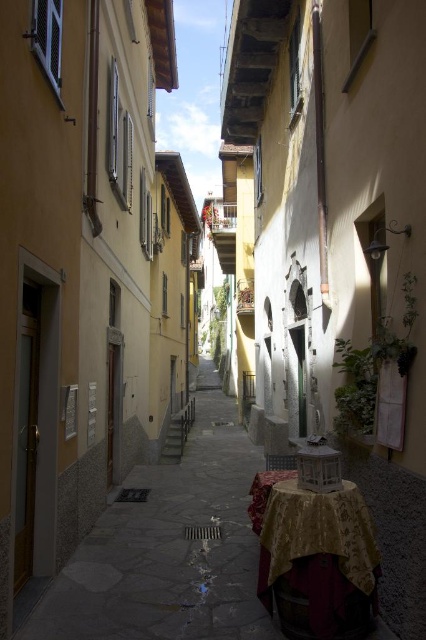
Question: Which point appears closest to the camera in this image?

Choices:
 (A) (307, 504)
 (B) (172, 493)

Answer: (A)

Question: Can you confirm if smooth stone path at center is wider than gold textured tablecloth at lower right?

Choices:
 (A) yes
 (B) no

Answer: (A)

Question: Which point is farther to the camera?

Choices:
 (A) gold textured tablecloth at lower right
 (B) smooth stone path at center

Answer: (B)

Question: Can you confirm if smooth stone path at center is smaller than gold textured tablecloth at lower right?

Choices:
 (A) no
 (B) yes

Answer: (A)

Question: From the image, what is the correct spatial relationship of smooth stone path at center in relation to gold textured tablecloth at lower right?

Choices:
 (A) right
 (B) left

Answer: (B)